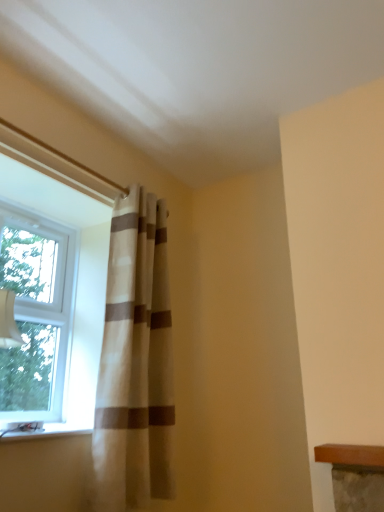
The width and height of the screenshot is (384, 512). I want to click on beige textured curtain at left, so click(135, 362).

You are a GUI agent. You are given a task and a screenshot of the screen. Output one action in this format:
    pyautogui.click(x=<x>, y=<y>)
    Task: Click on the white glossy window sill at lower left
    Image resolution: width=384 pixels, height=512 pixels.
    Given the screenshot: What is the action you would take?
    pyautogui.click(x=47, y=432)

This screenshot has height=512, width=384. What are the coordinates of `clear glass window at left` in the screenshot? It's located at (36, 315).

Is point (161, 260) positioned in front of point (49, 323)?

No, (161, 260) is further to viewer.

Is beige textured curtain at left taller than clear glass window at left?

Correct, beige textured curtain at left is much taller as clear glass window at left.

From the picture: Is beige textured curtain at left to the right of white glossy window sill at lower left from the viewer's perspective?

Yes, beige textured curtain at left is to the right of white glossy window sill at lower left.

Which is less distant, (141, 438) or (35, 435)?

The point (35, 435) is closer to the camera.

Considering the relative sizes of beige textured curtain at left and white glossy window sill at lower left in the image provided, is beige textured curtain at left smaller than white glossy window sill at lower left?

Incorrect, beige textured curtain at left is not smaller in size than white glossy window sill at lower left.

Locate an element on the screen. curtain lying above the white glossy window sill at lower left (from the image's perspective) is located at coordinates (135, 362).

What are the coordinates of `window sill that is below the clear glass window at left (from the image's perspective)` in the screenshot? It's located at (47, 432).

Is clear glass window at left facing towards white glossy window sill at lower left?

Yes, clear glass window at left faces towards white glossy window sill at lower left.

Is clear glass window at left touching white glossy window sill at lower left?

No.

Is point (65, 377) farther from camera compared to point (58, 430)?

Yes.

Is clear glass window at left inside or outside of beige textured curtain at left?

clear glass window at left cannot be found inside beige textured curtain at left.

From the image's perspective, is clear glass window at left on beige textured curtain at left?

Correct, clear glass window at left appears higher than beige textured curtain at left in the image.

Is clear glass window at left far from beige textured curtain at left?

No, there isn't a large distance between clear glass window at left and beige textured curtain at left.

Can we say white glossy window sill at lower left lies outside beige textured curtain at left?

Yes.

In the image, is white glossy window sill at lower left positioned in front of or behind beige textured curtain at left?

Clearly, white glossy window sill at lower left is in front of beige textured curtain at left.

Who is shorter, white glossy window sill at lower left or beige textured curtain at left?

white glossy window sill at lower left.

Considering the relative positions of white glossy window sill at lower left and beige textured curtain at left in the image provided, is white glossy window sill at lower left to the right of beige textured curtain at left from the viewer's perspective?

Incorrect, white glossy window sill at lower left is not on the right side of beige textured curtain at left.

Considering the sizes of white glossy window sill at lower left and clear glass window at left in the image, is white glossy window sill at lower left taller or shorter than clear glass window at left?

Considering their sizes, white glossy window sill at lower left has less height than clear glass window at left.

Considering the positions of objects white glossy window sill at lower left and clear glass window at left in the image provided, who is behind, white glossy window sill at lower left or clear glass window at left?

Positioned behind is clear glass window at left.

Consider the image. Between white glossy window sill at lower left and clear glass window at left, which one has smaller width?

clear glass window at left.

What's the angular difference between white glossy window sill at lower left and clear glass window at left's facing directions?

0.132 degrees.

Locate an element on the screen. This screenshot has height=512, width=384. curtain below the clear glass window at left (from the image's perspective) is located at coordinates (135, 362).

Identify the location of curtain on the right of white glossy window sill at lower left. This screenshot has width=384, height=512. (135, 362).

Considering their positions, is clear glass window at left positioned closer to white glossy window sill at lower left than beige textured curtain at left?

beige textured curtain at left is closer to white glossy window sill at lower left.

When comparing their distances from beige textured curtain at left, does white glossy window sill at lower left or clear glass window at left seem further?

Among the two, clear glass window at left is located further to beige textured curtain at left.

Considering their positions, is beige textured curtain at left positioned further to clear glass window at left than white glossy window sill at lower left?

white glossy window sill at lower left.

When comparing their distances from white glossy window sill at lower left, does beige textured curtain at left or clear glass window at left seem further?

clear glass window at left is further to white glossy window sill at lower left.

Estimate the real-world distances between objects in this image. Which object is further from clear glass window at left, white glossy window sill at lower left or beige textured curtain at left?

white glossy window sill at lower left lies further to clear glass window at left than the other object.

Estimate the real-world distances between objects in this image. Which object is further from beige textured curtain at left, clear glass window at left or white glossy window sill at lower left?

Among the two, clear glass window at left is located further to beige textured curtain at left.

Find the location of a particular element. window sill between clear glass window at left and beige textured curtain at left in the horizontal direction is located at coordinates (47, 432).